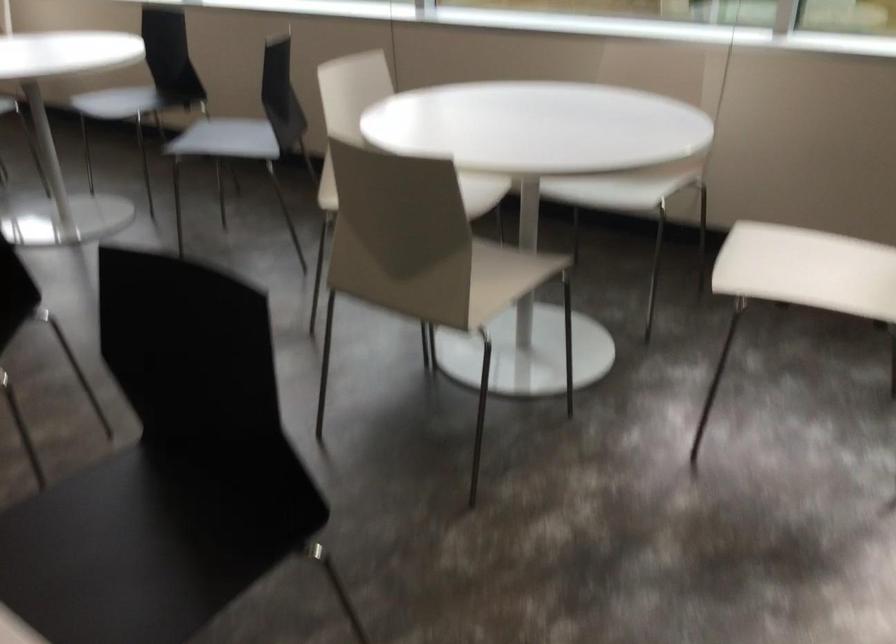
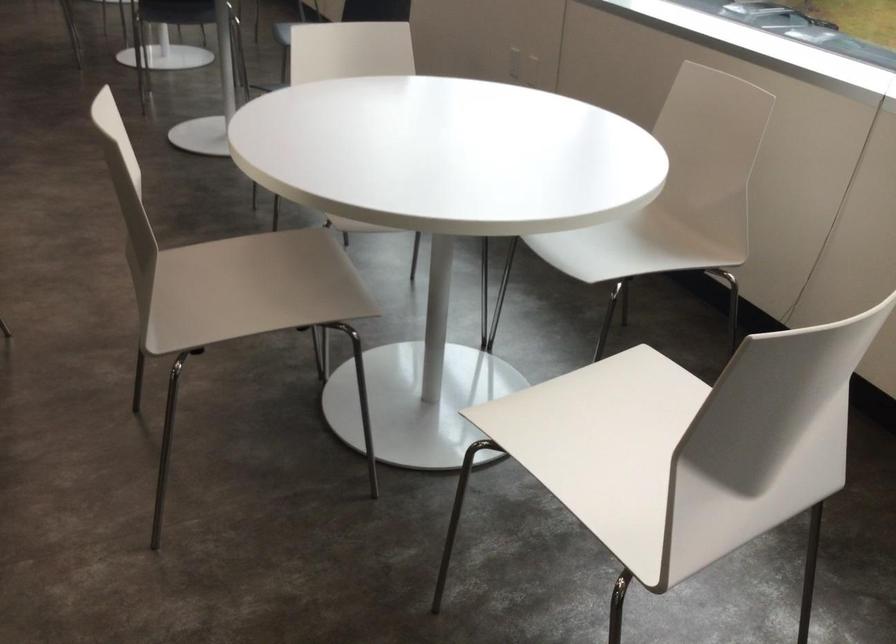
The point at (x=794, y=279) is marked in the first image. Where is the corresponding point in the second image?

(604, 444)